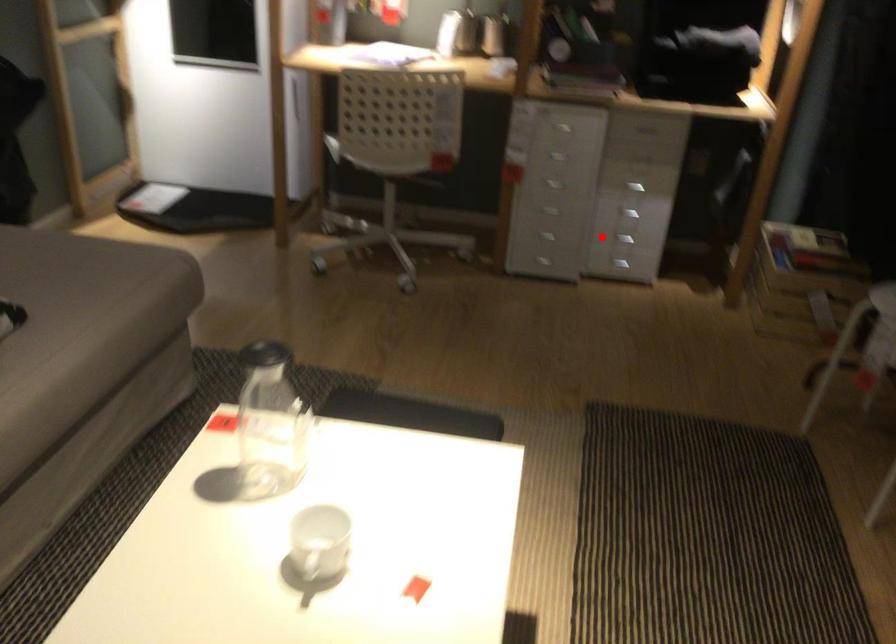
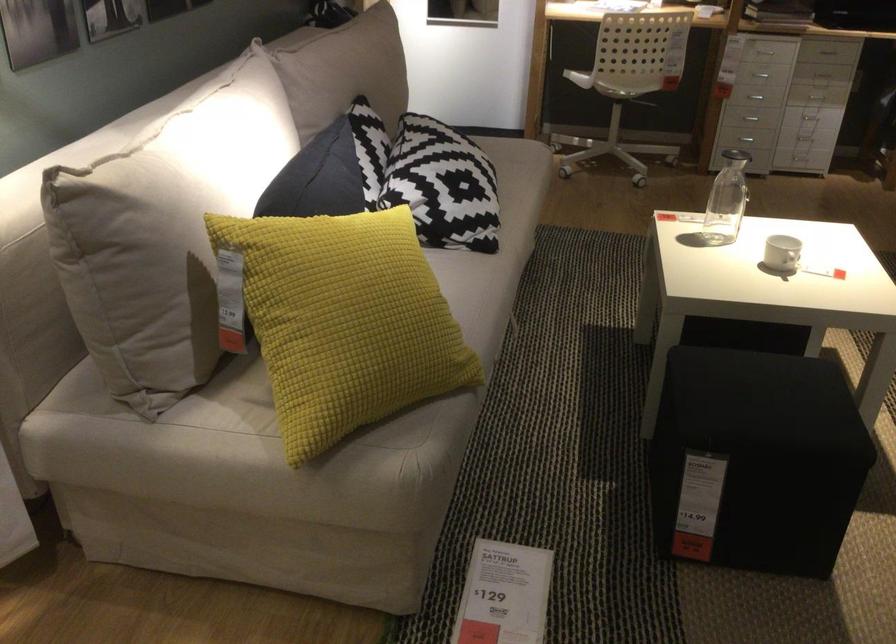
Question: I am providing you with two images of the same scene from different viewpoints. Image1 has a red point marked. In image2, the corresponding 3D location appears at what relative position? Reply with the corresponding letter.

Choices:
 (A) Closer
 (B) Farther

Answer: (B)